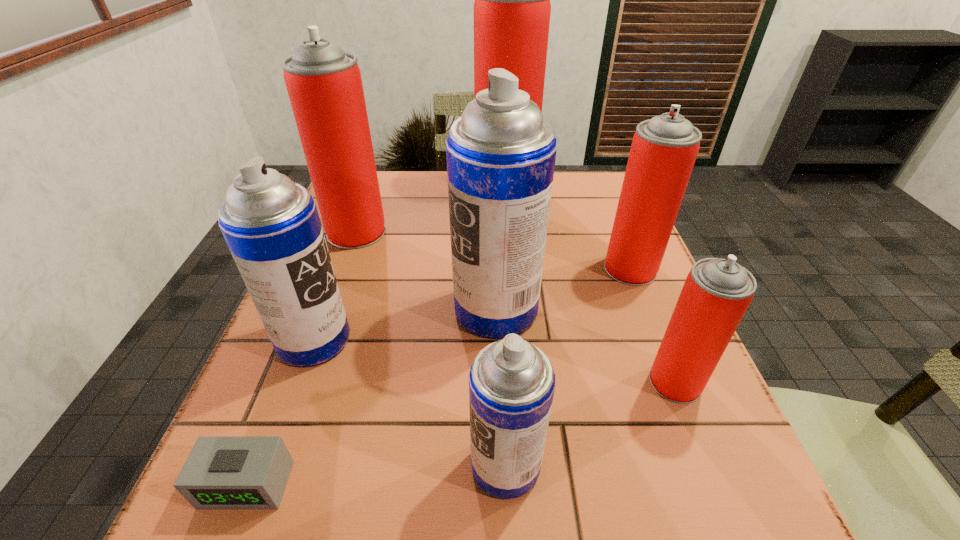
At what (x,y) coordinates should I click in order to perform the action: click on alarm clock. Please return your answer as a coordinate pair (x, y). This screenshot has width=960, height=540. Looking at the image, I should click on (221, 472).

The height and width of the screenshot is (540, 960). I want to click on free spot located on the front of the farthest aerosol can, so click(515, 296).

Identify the location of free space located on the label side of the biggest blue aerosol can. (364, 309).

At what (x,y) coordinates should I click in order to perform the action: click on free region located on the label side of the biggest blue aerosol can. Please return your answer as a coordinate pair (x, y). Image resolution: width=960 pixels, height=540 pixels. Looking at the image, I should click on (324, 309).

The image size is (960, 540). In order to click on free region located 0.090m on the label side of the biggest blue aerosol can in this screenshot , I will do `click(409, 309)`.

Locate an element on the screen. This screenshot has height=540, width=960. vacant space located 0.320m on the right of the second biggest red aerosol can is located at coordinates (517, 232).

Locate an element on the screen. The image size is (960, 540). free point located on the left of the second smallest red aerosol can is located at coordinates (532, 269).

What are the coordinates of `vacant space located 0.390m on the label side of the leftmost blue aerosol can` in the screenshot? It's located at (561, 340).

Locate an element on the screen. This screenshot has height=540, width=960. free spot located on the left of the smallest red aerosol can is located at coordinates (508, 382).

Locate an element on the screen. The image size is (960, 540). vacant space located 0.140m on the label side of the smallest blue aerosol can is located at coordinates (374, 465).